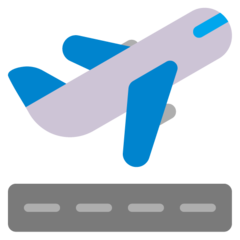
Where is `windows`? This screenshot has height=240, width=240. windows is located at coordinates (212, 24).